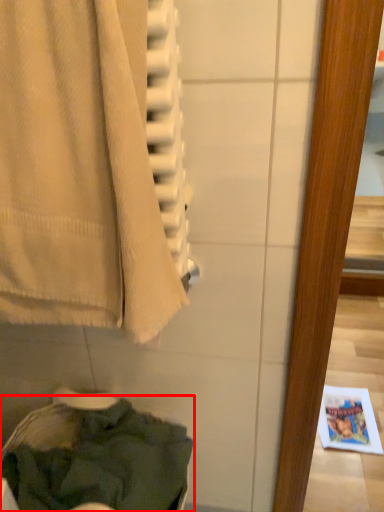
Question: Considering the relative positions of clothing (annotated by the red box) and towel in the image provided, where is clothing (annotated by the red box) located with respect to the staircase?

Choices:
 (A) right
 (B) left

Answer: (B)